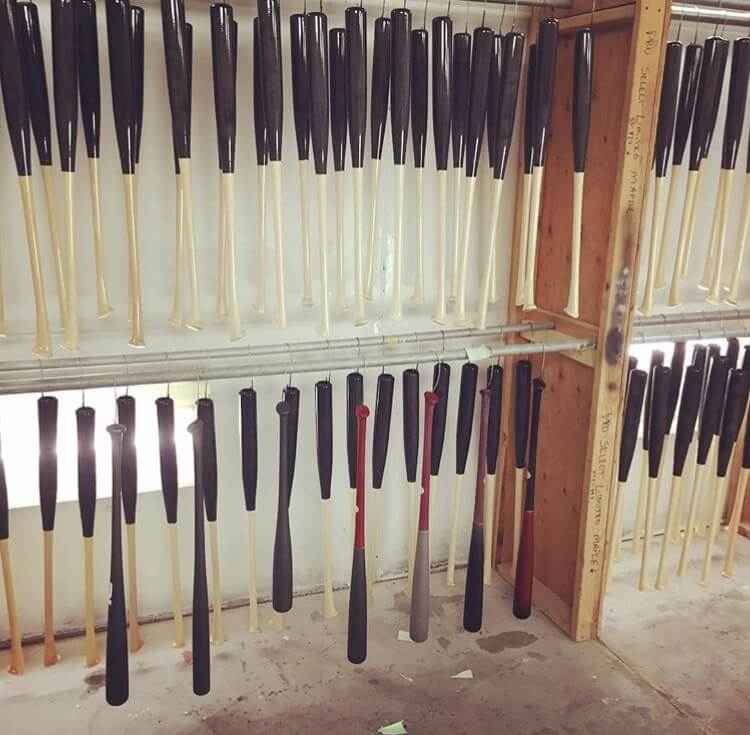
You are a GUI agent. You are given a task and a screenshot of the screen. Output one action in this format:
    pyautogui.click(x=<x>, y=<y>)
    Task: Click on the divider
    
    Given the screenshot: What is the action you would take?
    (562, 473)